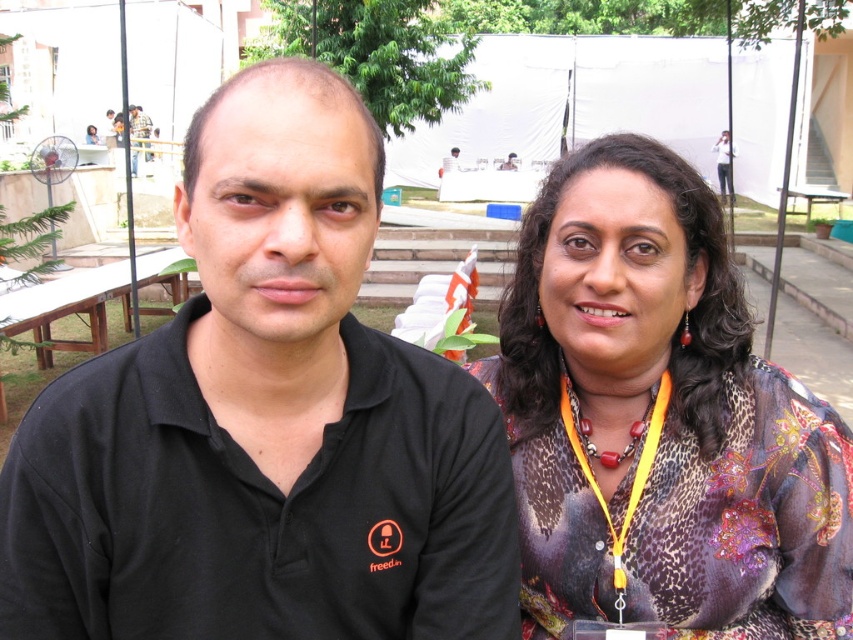
Question: Which point appears closest to the camera in this image?

Choices:
 (A) (144, 145)
 (B) (448, 556)
 (C) (572, 612)
 (D) (612, 461)

Answer: (B)

Question: Among these points, which one is nearest to the camera?

Choices:
 (A) (757, 412)
 (B) (196, 388)
 (C) (126, 145)

Answer: (B)

Question: Is printed silk blouse at center below red beaded necklace at center?

Choices:
 (A) yes
 (B) no

Answer: (B)

Question: Does black matte shirt at left have a larger size compared to matte black shirt at center?

Choices:
 (A) yes
 (B) no

Answer: (A)

Question: Is printed silk blouse at center smaller than matte black shirt at center?

Choices:
 (A) no
 (B) yes

Answer: (A)

Question: Which point appears closest to the camera in this image?

Choices:
 (A) (137, 106)
 (B) (595, 154)
 (C) (639, 433)

Answer: (B)